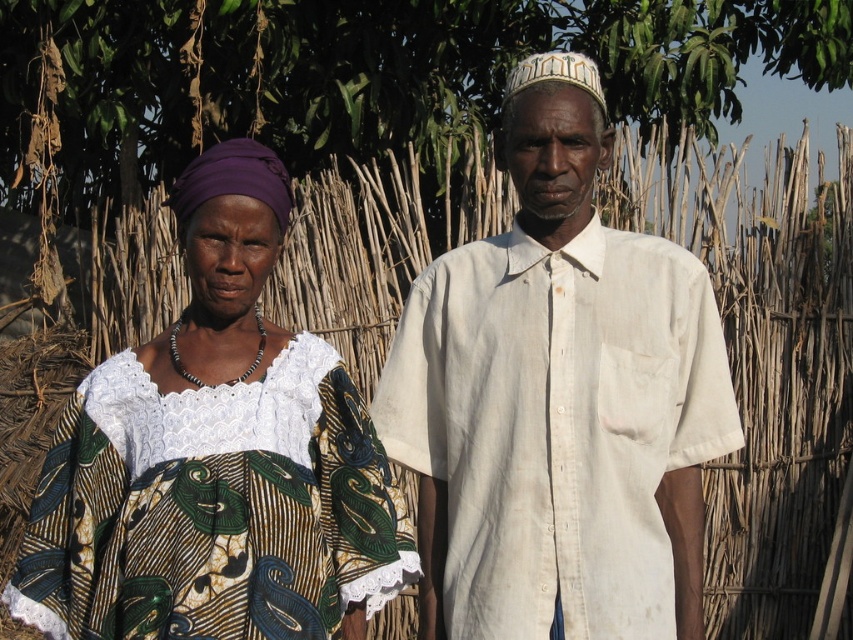
Who is more distant from viewer, (450, 544) or (244, 595)?

The point (450, 544) is behind.

Who is positioned more to the left, white cotton shirt at center or printed fabric dress at left?

From the viewer's perspective, printed fabric dress at left appears more on the left side.

Where is `white cotton shirt at center`? The height and width of the screenshot is (640, 853). white cotton shirt at center is located at coordinates (558, 400).

Can you confirm if printed fabric dress at left is wider than green leafy tree at upper center?

No.

Which is more to the right, printed fabric dress at left or green leafy tree at upper center?

Positioned to the right is green leafy tree at upper center.

Is point (115, 468) positioned before point (22, 72)?

Yes, it is.

What are the coordinates of `printed fabric dress at left` in the screenshot? It's located at (216, 458).

Does white cotton shirt at center have a greater height compared to green leafy tree at upper center?

Indeed, white cotton shirt at center has a greater height compared to green leafy tree at upper center.

Between point (576, 240) and point (137, 147), which one is positioned behind?

Point (137, 147)

What are the coordinates of `white cotton shirt at center` in the screenshot? It's located at (558, 400).